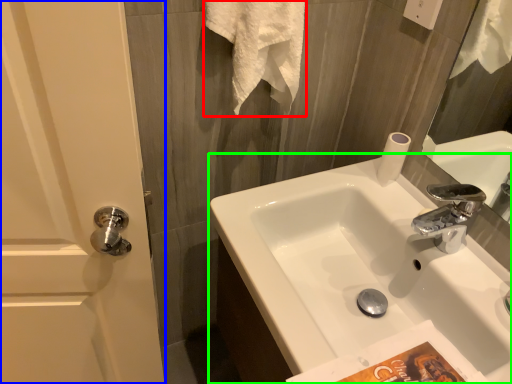
Question: Considering the real-world distances, which object is farthest from bath towel (highlighted by a red box)? screen door (highlighted by a blue box) or sink (highlighted by a green box)?

Choices:
 (A) screen door
 (B) sink

Answer: (A)